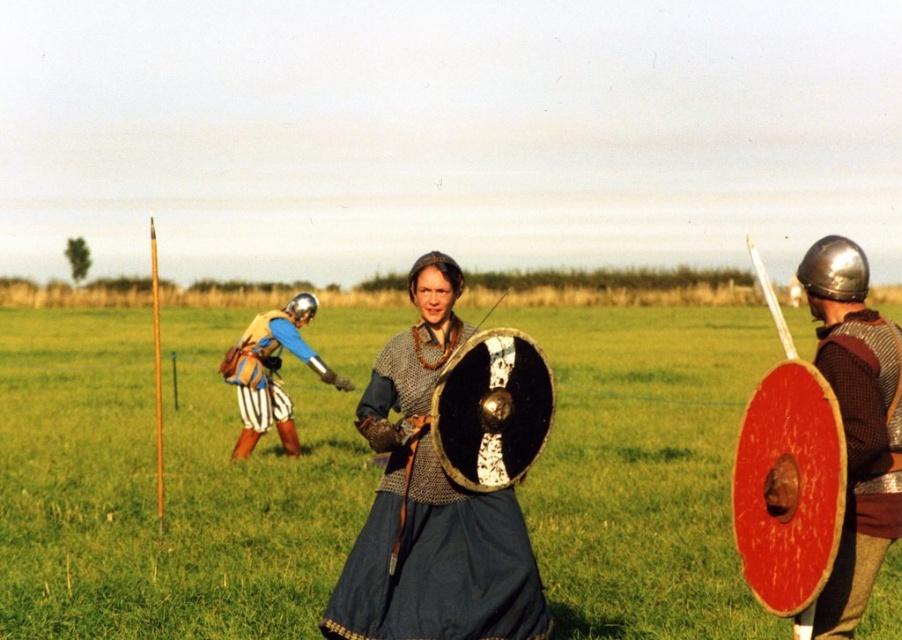
Question: Can you confirm if red wooden shield at right is positioned below metallic blue armor at center?

Choices:
 (A) no
 (B) yes

Answer: (A)

Question: Which point is farther to the camera?

Choices:
 (A) (131, 332)
 (B) (482, 627)

Answer: (A)

Question: Is the position of green grass at center more distant than that of red wooden shield at right?

Choices:
 (A) yes
 (B) no

Answer: (A)

Question: Which of the following is the farthest from the observer?

Choices:
 (A) green grass at center
 (B) red wooden shield at right

Answer: (A)

Question: Does chainmail armor at center appear over red wooden shield at right?

Choices:
 (A) no
 (B) yes

Answer: (A)

Question: Based on their relative distances, which object is farther from the red wooden shield at right?

Choices:
 (A) metallic blue armor at center
 (B) green grass at center

Answer: (B)